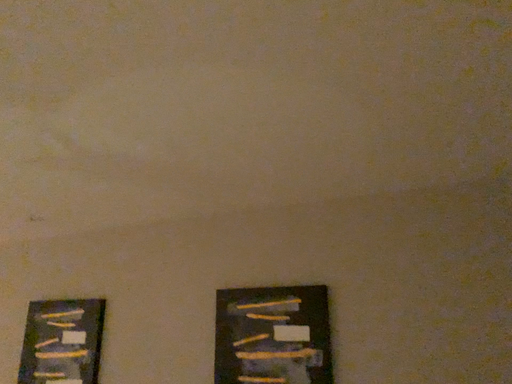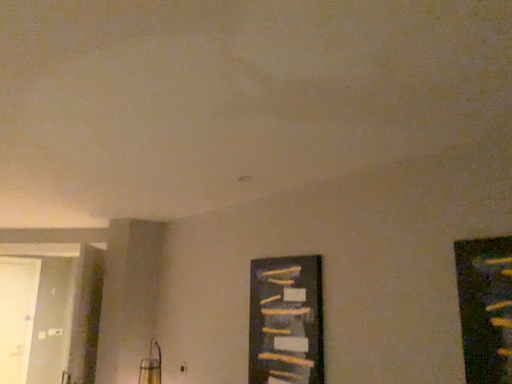
Question: How did the camera likely rotate when shooting the video?

Choices:
 (A) rotated left
 (B) rotated right

Answer: (A)